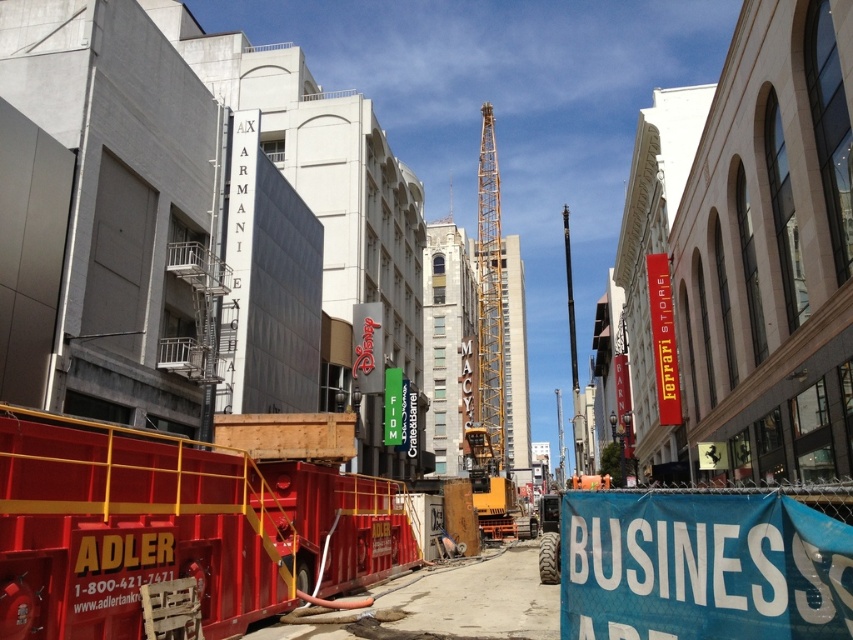
Question: Which of the following is the farthest from the observer?

Choices:
 (A) (663, 573)
 (B) (477, 186)

Answer: (B)

Question: Does blue fabric sign at lower right have a greater width compared to yellow metallic crane at center?

Choices:
 (A) yes
 (B) no

Answer: (B)

Question: Is blue fabric sign at lower right to the left of yellow metallic crane at center from the viewer's perspective?

Choices:
 (A) yes
 (B) no

Answer: (A)

Question: Observing the image, what is the correct spatial positioning of blue fabric sign at lower right in reference to yellow metallic crane at center?

Choices:
 (A) below
 (B) above

Answer: (A)